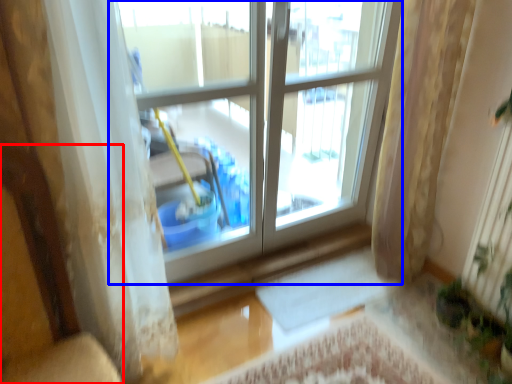
Question: Which point is closer to the camera, armchair (highlighted by a red box) or window (highlighted by a blue box)?

Choices:
 (A) armchair
 (B) window

Answer: (A)